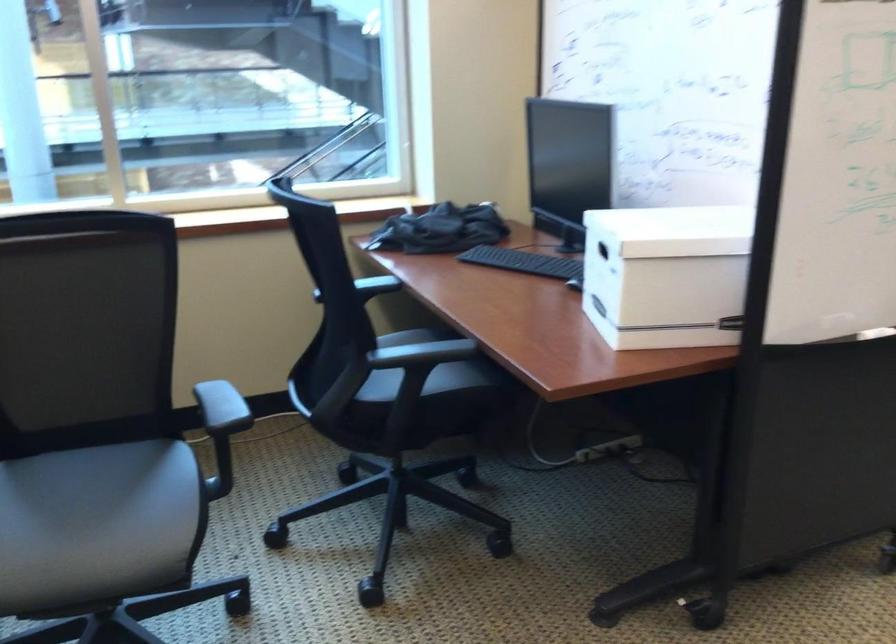
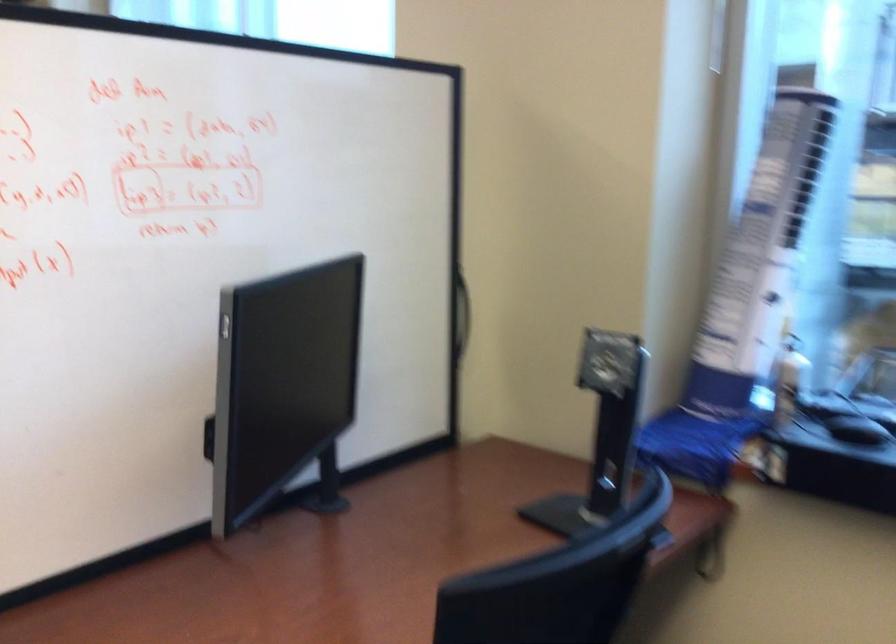
Locate, in the second image, the point that corresponds to pixel 503 142 in the first image.

(461, 313)